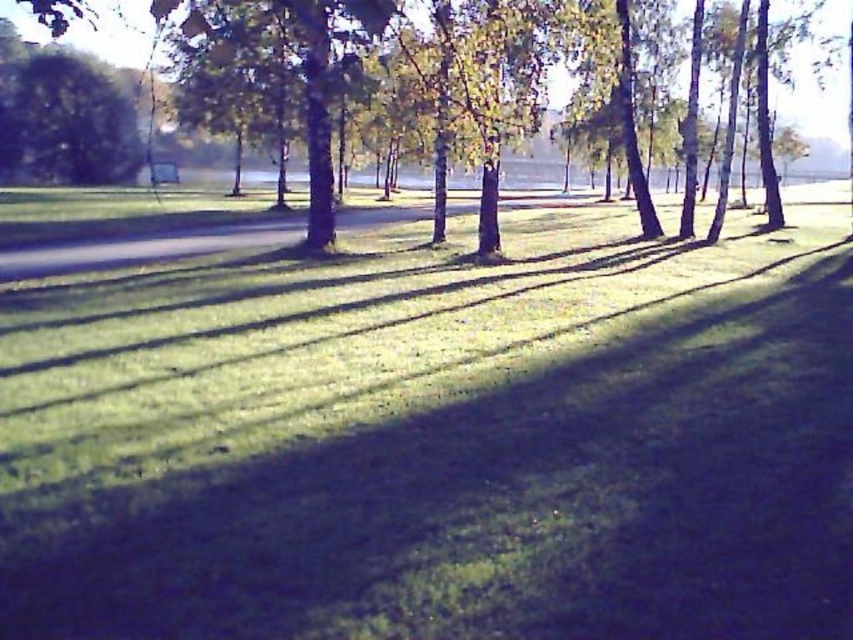
Question: Which point is closer to the camera taking this photo?

Choices:
 (A) (70, 173)
 (B) (39, 406)
 (C) (99, 52)

Answer: (B)

Question: Is green leafy tree at upper left smaller than green leafy tree at center?

Choices:
 (A) yes
 (B) no

Answer: (A)

Question: Does green grassy at center have a larger size compared to green leafy tree at upper left?

Choices:
 (A) no
 (B) yes

Answer: (B)

Question: Does green grassy at center come behind green leafy tree at upper left?

Choices:
 (A) yes
 (B) no

Answer: (B)

Question: Which point appears farthest from the camera in this image?

Choices:
 (A) (120, 42)
 (B) (119, 115)

Answer: (A)

Question: Which of the following is the closest to the observer?

Choices:
 (A) green leafy tree at upper left
 (B) green grassy at center
 (C) green leafy tree at center

Answer: (B)